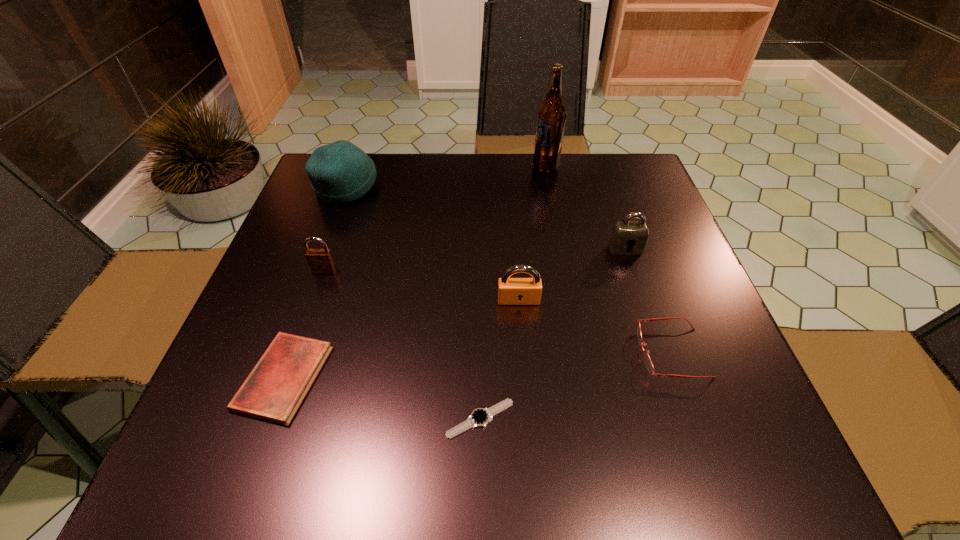
Where is `diary located at the left edge`? diary located at the left edge is located at coordinates (273, 391).

The width and height of the screenshot is (960, 540). Find the location of `padlock present at the right edge`. padlock present at the right edge is located at coordinates (625, 234).

Identify the location of spectacles positioned at the right edge. The width and height of the screenshot is (960, 540). coord(648,362).

In order to click on object at the far left corner in this screenshot , I will do `click(340, 172)`.

The width and height of the screenshot is (960, 540). Identify the location of object located at the near left corner. tap(273, 391).

In the image, there is a desktop. Identify the location of free space at the far edge. This screenshot has width=960, height=540. (547, 173).

This screenshot has height=540, width=960. In the image, there is a desktop. In order to click on vacant space at the near edge in this screenshot , I will do `click(558, 425)`.

This screenshot has height=540, width=960. What are the coordinates of `vacant space at the left edge of the desktop` in the screenshot? It's located at (311, 237).

In the image, there is a desktop. At what (x,y) coordinates should I click in order to perform the action: click on vacant space at the right edge. Please return your answer as a coordinate pair (x, y). This screenshot has height=540, width=960. Looking at the image, I should click on (665, 249).

The width and height of the screenshot is (960, 540). In the image, there is a desktop. Identify the location of vacant space at the near left corner. click(246, 468).